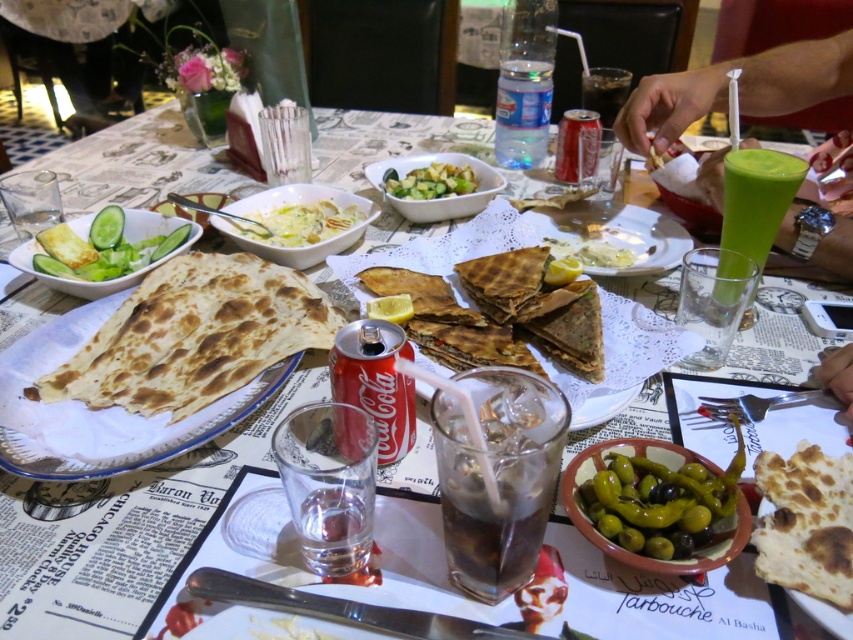
Can you confirm if brown/crumbly tortilla at lower right is shorter than white ceramic plate at center?

Indeed, brown/crumbly tortilla at lower right has a lesser height compared to white ceramic plate at center.

Who is positioned more to the right, brown/crumbly tortilla at lower right or white ceramic plate at center?

brown/crumbly tortilla at lower right is more to the right.

Which is behind, point (846, 515) or point (575, 228)?

Point (575, 228)

Find the location of a particular element. brown/crumbly tortilla at lower right is located at coordinates (805, 522).

Can you confirm if dark brown carbonated drink at center is smaller than green leafy salad at left?

Yes, dark brown carbonated drink at center is smaller than green leafy salad at left.

In order to click on dark brown carbonated drink at center in this screenshot , I will do `click(498, 477)`.

Between brown matte tortilla at center and dark brown carbonated drink at center, which one appears on the left side from the viewer's perspective?

Positioned to the left is brown matte tortilla at center.

The height and width of the screenshot is (640, 853). What are the coordinates of `brown matte tortilla at center` in the screenshot? It's located at pos(194,336).

Is point (207, 342) behind point (451, 499)?

Yes, point (207, 342) is farther from viewer.

Where is `brown matte tortilla at center`? brown matte tortilla at center is located at coordinates (194, 336).